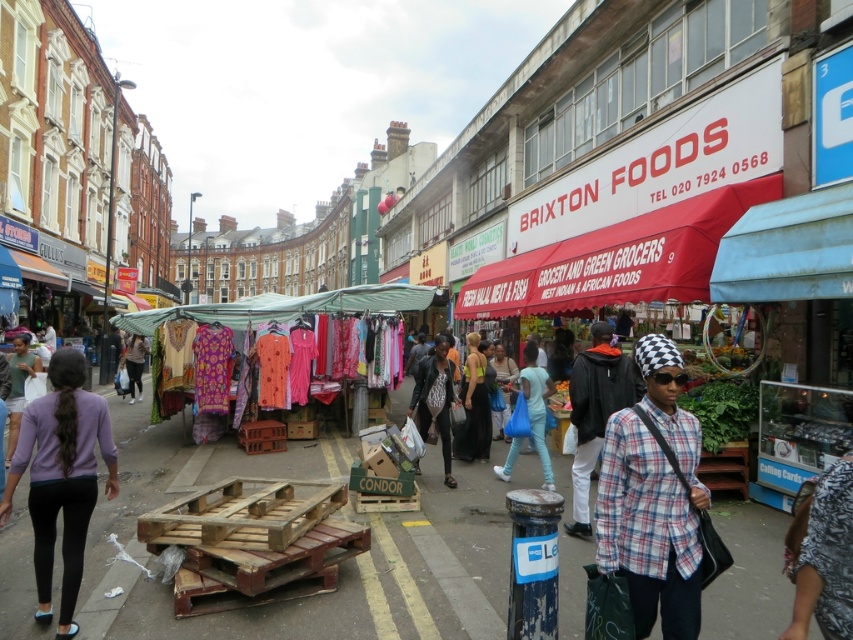
Which is behind, point (426, 429) or point (485, 376)?

The point (485, 376) is behind.

Between point (421, 420) and point (474, 388), which one is positioned behind?

Point (474, 388)

Where is `leather jacket at center`? leather jacket at center is located at coordinates (434, 400).

Is leather jacket at center to the right of matte black pants at lower left from the viewer's perspective?

Yes, leather jacket at center is to the right of matte black pants at lower left.

Between point (444, 432) and point (138, 353), which one is positioned in front?

Point (444, 432)

What are the coordinates of `leather jacket at center` in the screenshot? It's located at click(434, 400).

Can you confirm if plaid cotton shirt at center is smaller than red fabric canopy at upper right?

Indeed, plaid cotton shirt at center has a smaller size compared to red fabric canopy at upper right.

Who is more distant from viewer, (631, 506) or (527, 301)?

The point (527, 301) is more distant.

Is point (633, 532) farther from viewer compared to point (741, 192)?

That is False.

Find the location of a particular element. The image size is (853, 640). plaid cotton shirt at center is located at coordinates (653, 499).